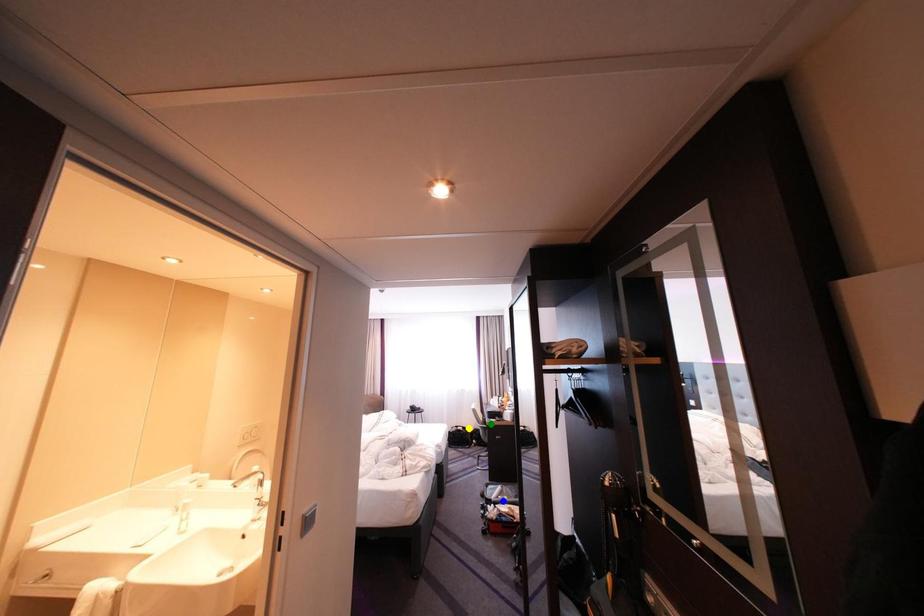
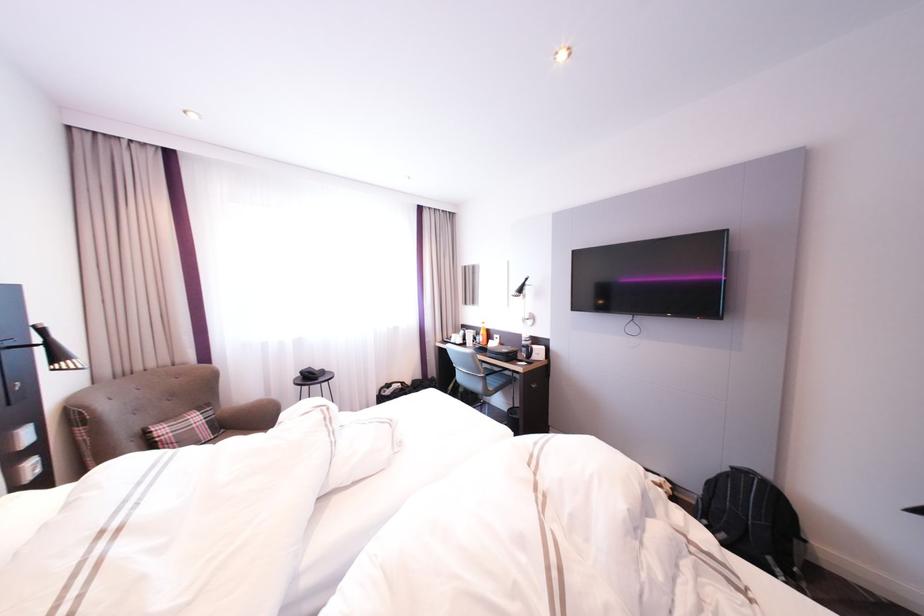
I am providing you with two images of the same scene from different viewpoints. Three points are marked in image1. Which point corresponds to a part or object that is occluded in image2?In image1, three points are marked. Which of them correspond to a part or object that is occluded in image2?Among the three points shown in image1, which one corresponds to a part or object that is no longer visible due to occlusion in image2?

Invisible in image2: blue point.